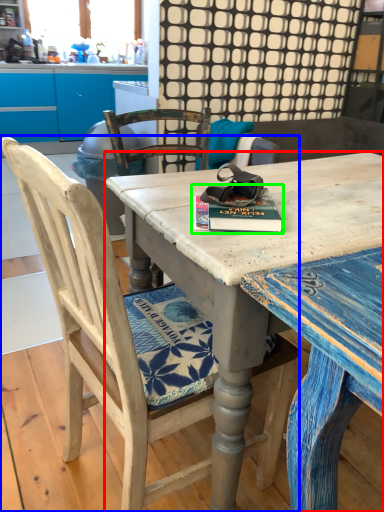
Question: Which is nearer to the desk (highlighted by a red box)? chair (highlighted by a blue box) or paperback book (highlighted by a green box).

Choices:
 (A) chair
 (B) paperback book

Answer: (B)